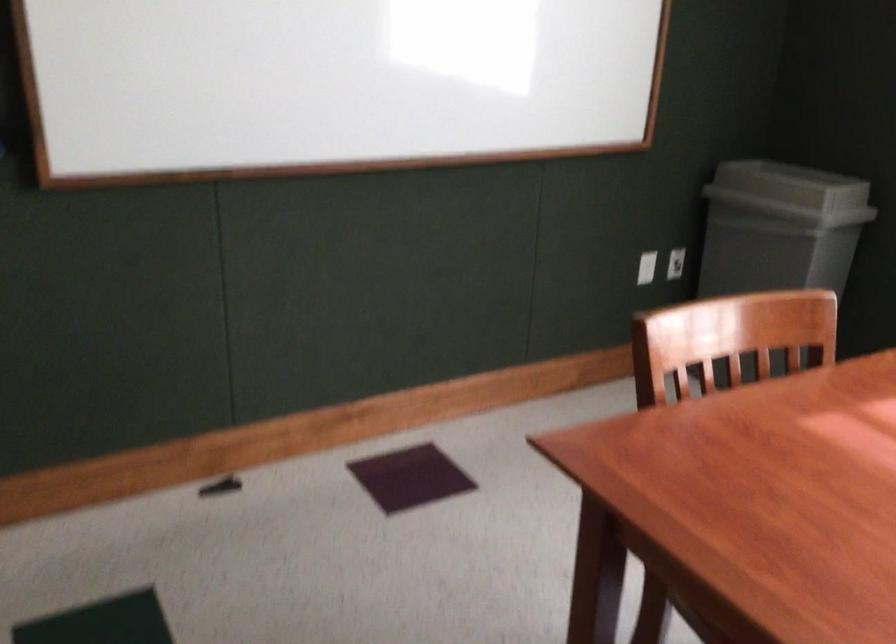
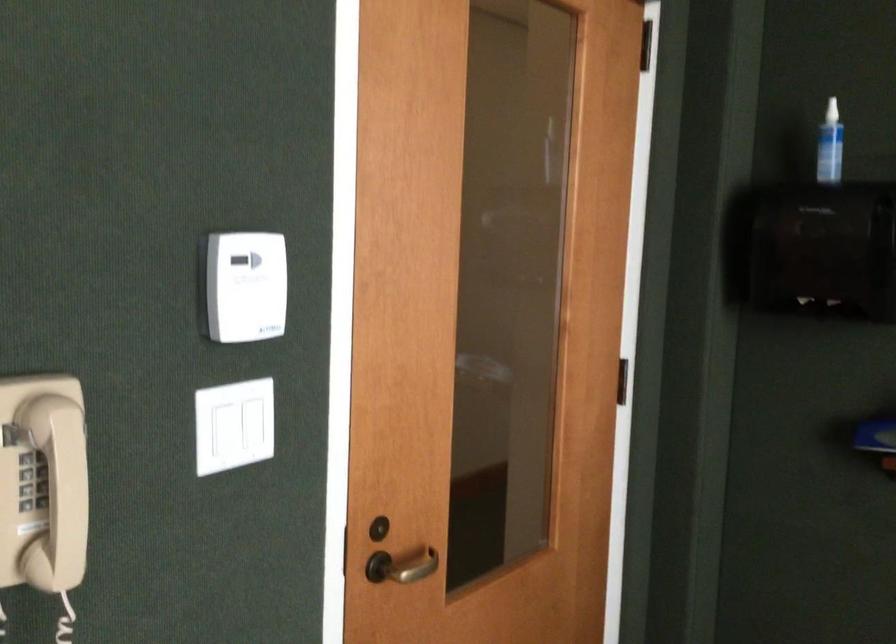
Question: The camera is either moving clockwise (left) or counter-clockwise (right) around the object. The first image is from the beginning of the video and the second image is from the end. Is the camera moving left or right when shooting the video?

Choices:
 (A) Left
 (B) Right

Answer: (B)